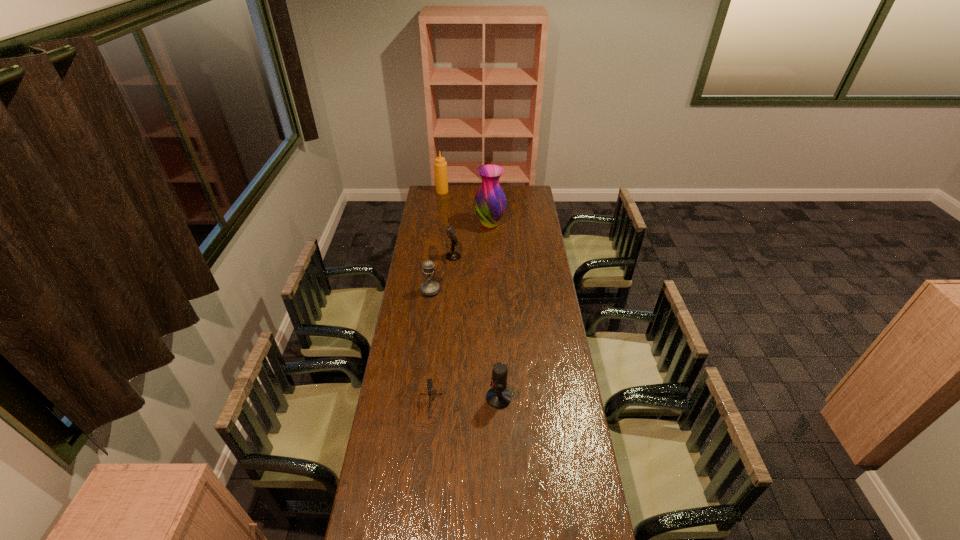
Identify the location of vacant space located on the front-facing side of the fourth nearest object. The height and width of the screenshot is (540, 960). 491,258.

Identify the location of free region located on the front-facing side of the second farthest microphone. (428, 305).

Locate an element on the screen. The width and height of the screenshot is (960, 540). free space located on the side of the rightmost microphone with the red ring is located at coordinates (394, 398).

Identify the location of free point located on the side of the rightmost microphone with the red ring. (466, 398).

At what (x,y) coordinates should I click in order to perform the action: click on free space located on the side of the rightmost microphone with the red ring. Please return your answer as a coordinate pair (x, y). This screenshot has height=540, width=960. Looking at the image, I should click on (406, 398).

Identify the location of free point located 0.360m on the stand of the shortest microphone. The height and width of the screenshot is (540, 960). (417, 535).

Find the location of a particular element. object situated at the far edge is located at coordinates (440, 165).

Where is `condiment situated at the left edge`? This screenshot has height=540, width=960. condiment situated at the left edge is located at coordinates (440, 165).

Identify the location of object positioned at the far left corner. (440, 165).

This screenshot has width=960, height=540. I want to click on free space at the left edge of the desktop, so click(x=408, y=277).